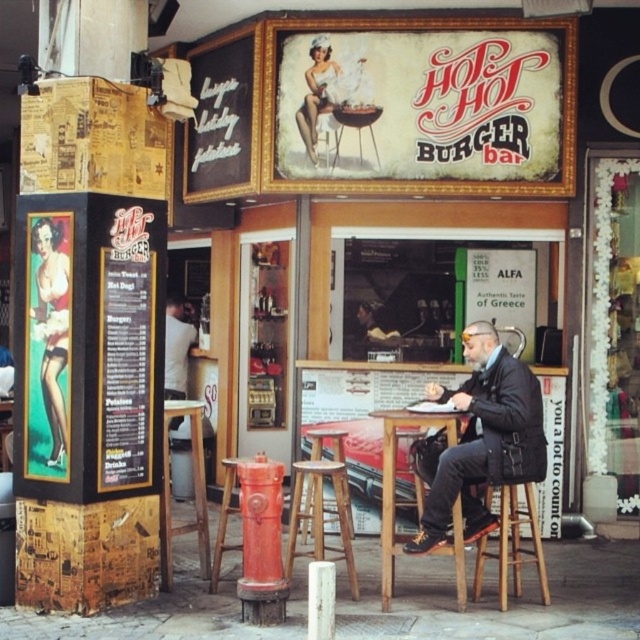
You are a customer standing at the entrance of Hot Hot Burger Bar and see the black leather jacket at center and the metallic red fire hydrant at center. Which object is located to the right of the other?

The black leather jacket at center is positioned on the right side of metallic red fire hydrant at center.

You are a delivery person who needs to place a dark brown leather jacket at center and a metallic red fire hydrant at center on a shelf. The shelf has limited space. Which object should you place first to ensure both fit?

The dark brown leather jacket at center is bigger than the metallic red fire hydrant at center, so you should place the dark brown leather jacket at center first to ensure both fit on the shelf.